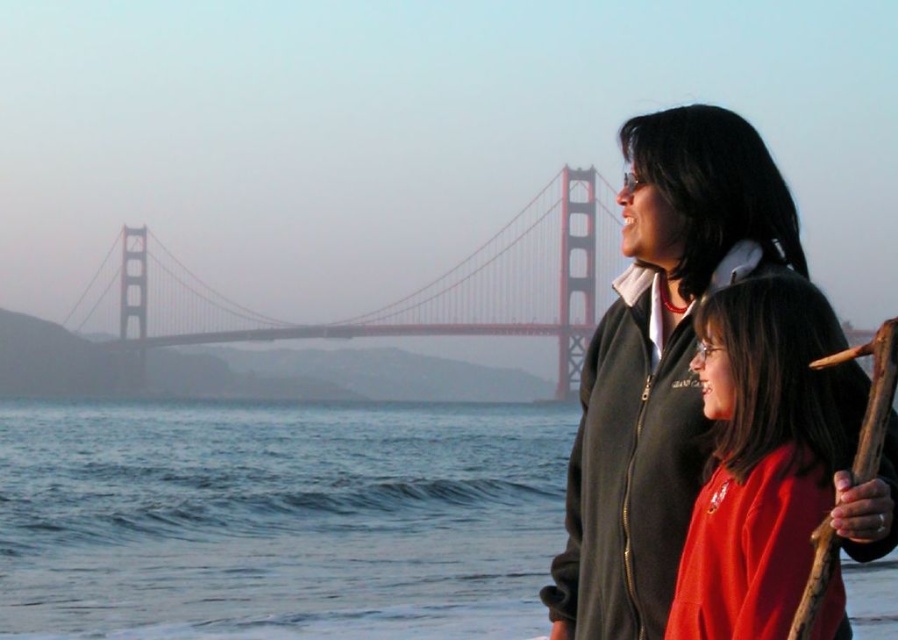
You are a drone operator tasked with capturing aerial footage of the red painted steel bridge at center. Your drone has a maximum flight range of 150 meters. If you launch it from the blue water at lower left, will it be able to reach the bridge without exceeding its range?

The distance between the blue water at lower left and the red painted steel bridge at center is 156.79 meters. Since the drone can only fly up to 150 meters, it will not be able to reach the bridge without exceeding its range.

You are a photographer planning to take a photo of the two people in the scene. You want to ensure that both the dark gray fleece jacket at right and the matte red sweater at center are clearly visible in the frame. Based on their positions, which direction should you position yourself relative to the subjects to capture both effectively?

You should position yourself to the right of the subjects because the dark gray fleece jacket at right is to the left of the matte red sweater at center. This positioning will ensure both are visible without one blocking the other.

Based on the coordinates provided, where is the dark gray fleece jacket at right located in the image?

The dark gray fleece jacket at right is located at the coordinates point (659, 362) in the image.